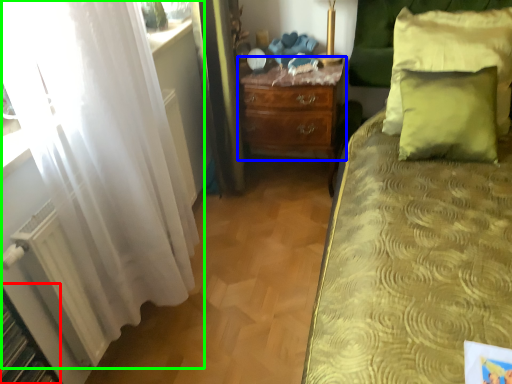
Question: Which is nearer to the shelf (highlighted by a red box)? nightstand (highlighted by a blue box) or curtain (highlighted by a green box).

Choices:
 (A) nightstand
 (B) curtain

Answer: (B)